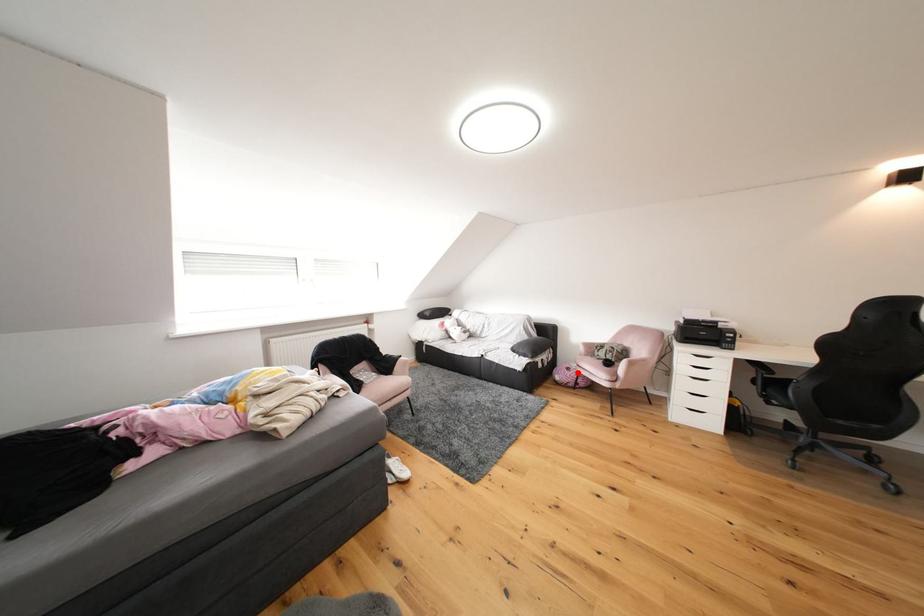
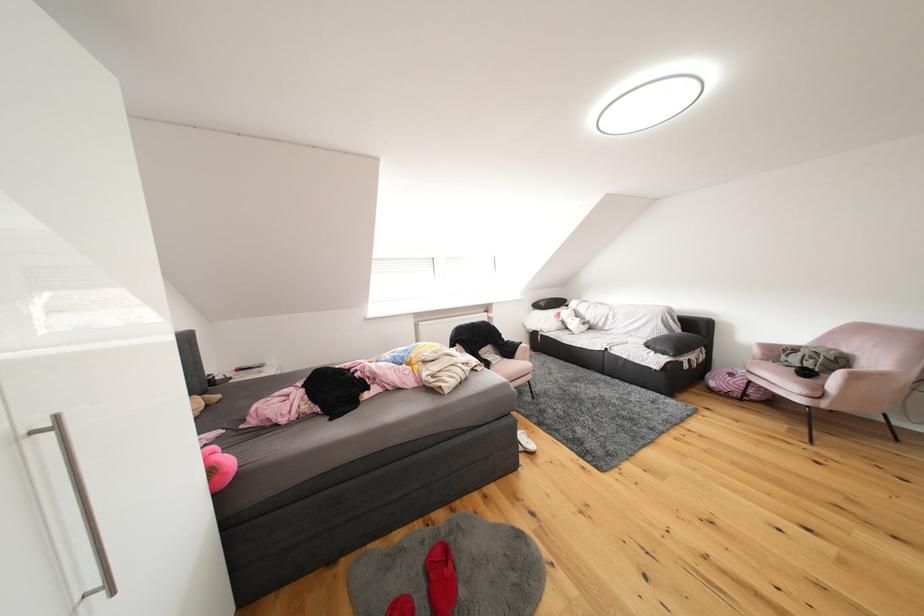
Find the pixel in the second image that matches the highlighted location in the first image.

(740, 379)